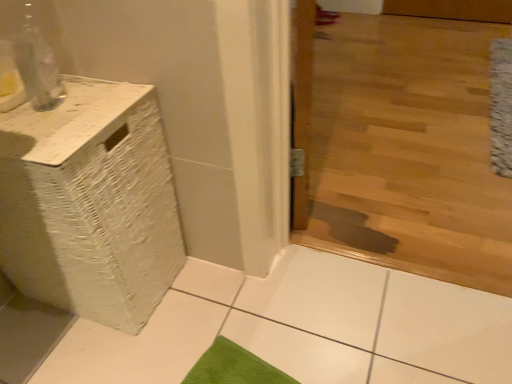
Find the location of a particular element. vacant area that is situated to the right of white woven basket at left is located at coordinates (222, 313).